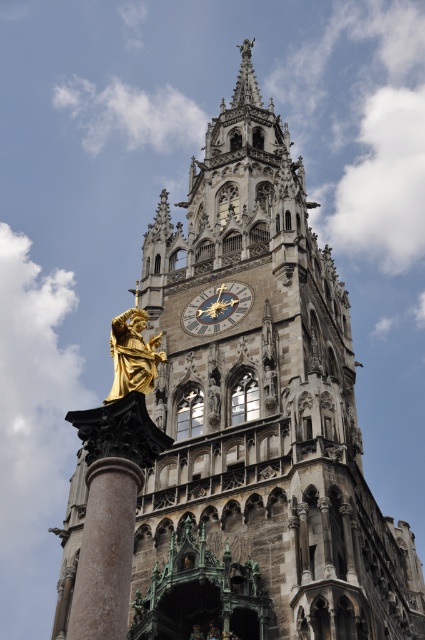
You are an architect designing a new clock tower and want to ensure the goldmetallicclock at center is proportionate to the polished marble column at center. Based on the image, which object should you make larger in your design?

The polished marble column at center should be larger than the goldmetallicclock at center in your design, as it is already larger in the original image.

You are standing in front of the Gothic clock tower and want to take a photo. You notice two points marked on the tower at coordinates point (129, 368) and point (197, 333). Which point is closer to your camera lens when focusing?

Point (129, 368) is closer to the camera than point (197, 333), so you should focus on that point for better clarity.